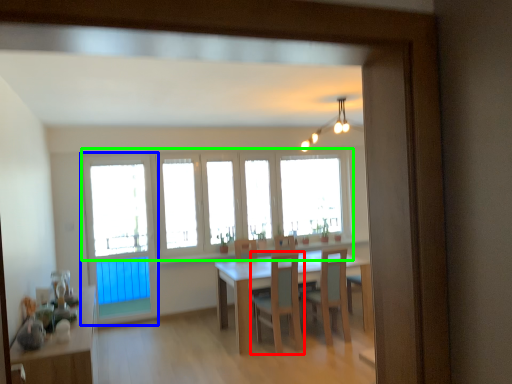
Question: Which object is the closest to the chair (highlighted by a red box)? Choose among these: screen door (highlighted by a blue box) or window (highlighted by a green box).

Choices:
 (A) screen door
 (B) window

Answer: (B)